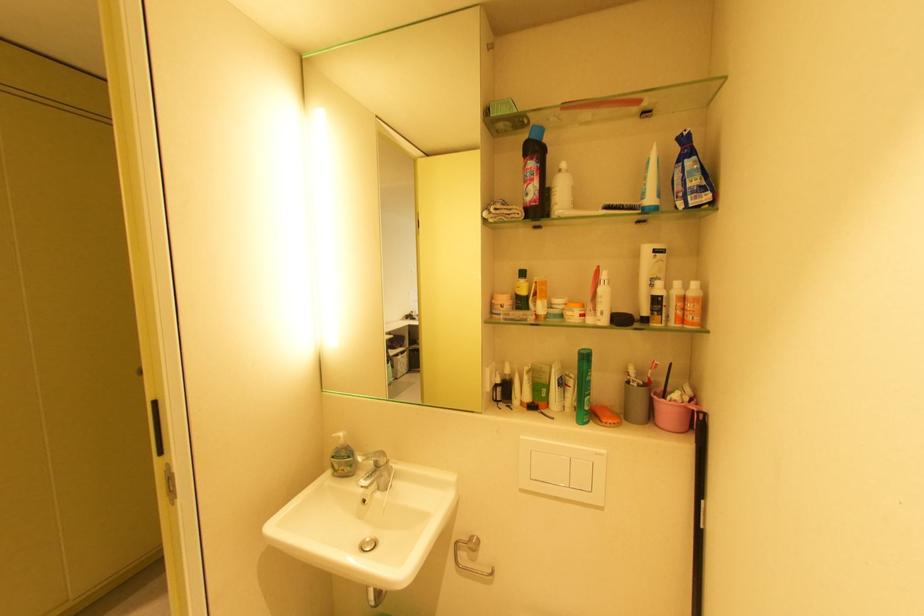
Describe the element at coordinates (533, 174) in the screenshot. I see `the black plastic bottle` at that location.